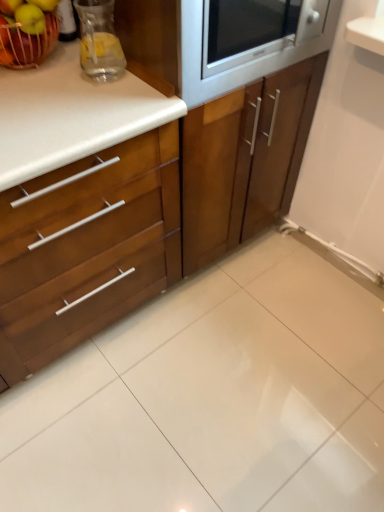
What are the coordinates of `vacant space situated above white glossy ceramic tile at center (from a real-world perspective)` in the screenshot? It's located at (238, 388).